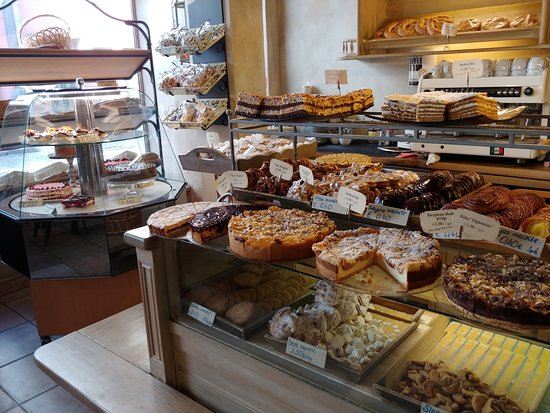
Where is `basket`? The width and height of the screenshot is (550, 413). basket is located at coordinates (55, 33).